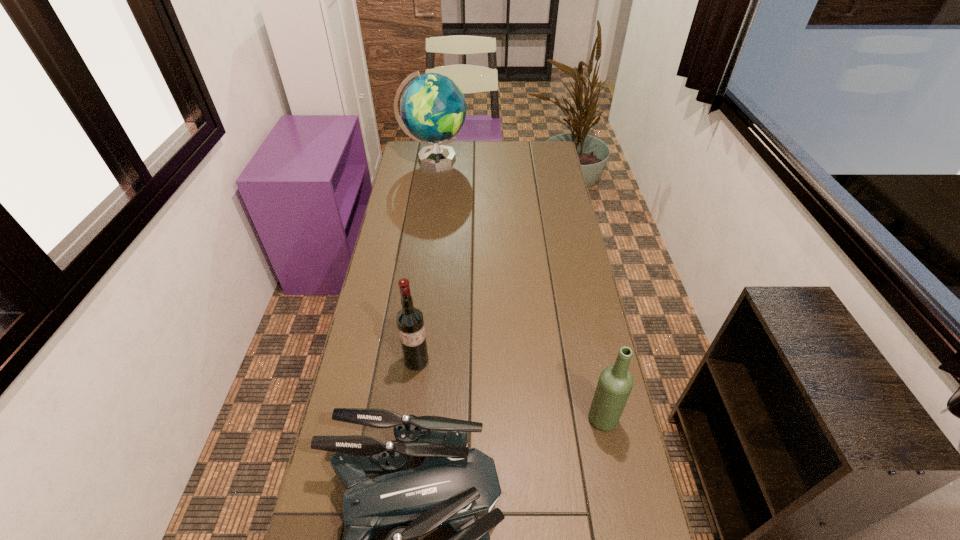
Find the location of a particular element. free space that satisfies the following two spatial constraints: 1. on the front and back of the nearer wine bottle; 2. on the left side of the second farthest object is located at coordinates (410, 420).